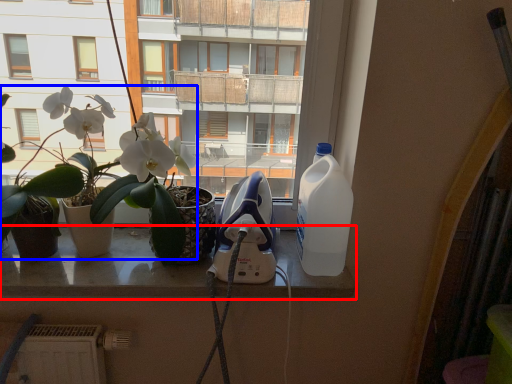
Question: Which object is closer to the camera taking this photo, window (highlighted by a red box) or houseplant (highlighted by a blue box)?

Choices:
 (A) window
 (B) houseplant

Answer: (B)